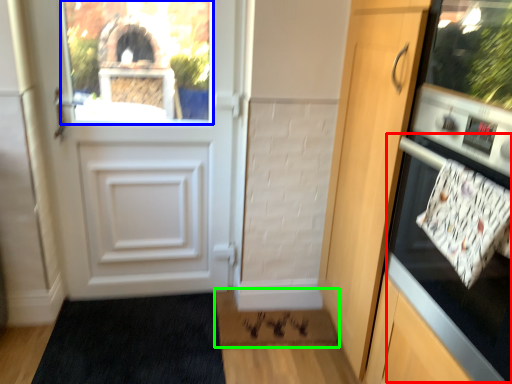
Question: Which is farther away from oven (highlighted by a red box)? window screen (highlighted by a blue box) or doormat (highlighted by a green box)?

Choices:
 (A) window screen
 (B) doormat

Answer: (A)